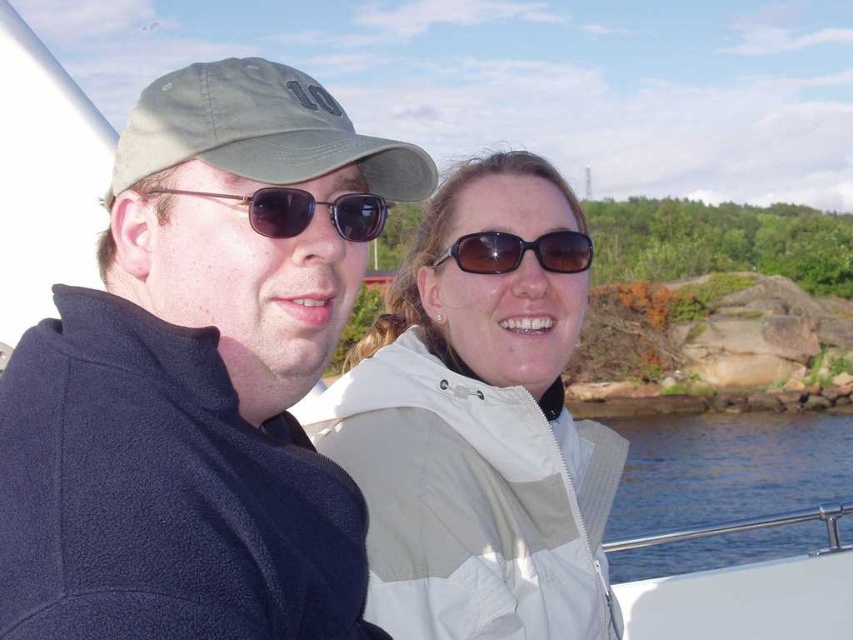
Question: Is dark blue fleece jacket at left wider than brown reflective sunglasses at center?

Choices:
 (A) yes
 (B) no

Answer: (A)

Question: Which point is farther to the camera?

Choices:
 (A) white matte jacket at center
 (B) blue water at lower right

Answer: (B)

Question: From the image, what is the correct spatial relationship of white matte jacket at center in relation to brown reflective sunglasses at center?

Choices:
 (A) above
 (B) below

Answer: (B)

Question: Does white matte jacket at center have a larger size compared to green fabric baseball cap at upper left?

Choices:
 (A) no
 (B) yes

Answer: (B)

Question: Which of the following is the closest to the observer?

Choices:
 (A) brown reflective sunglasses at center
 (B) green fabric baseball cap at upper left

Answer: (B)

Question: Which of the following is the farthest from the observer?

Choices:
 (A) (100, 324)
 (B) (239, 156)

Answer: (B)